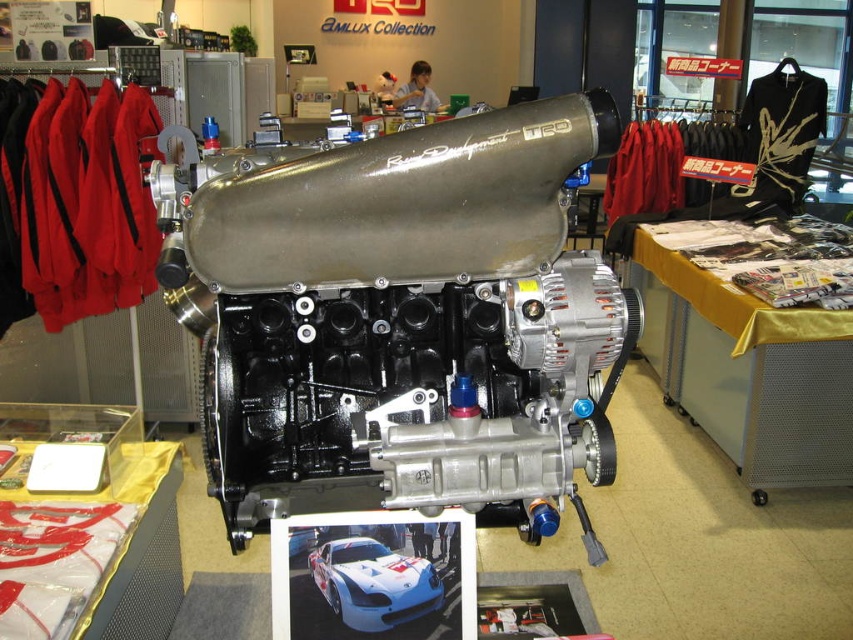
You are a technician who needs to inspect the silver metallic engine at center. If your arm can reach up to 3 feet, can you touch the engine without moving your position?

The silver metallic engine at center is 3.83 feet away from the viewer. Since your arm can only reach up to 3 feet, you cannot touch the engine without moving your position.

Based on the photo, you are an engineer inspecting the engine displayed in the showroom. You notice a specific point at coordinates (401, 317). Based on the engine layout, what component is located at that point?

The point at coordinates (401, 317) corresponds to the silver metallic engine at center.

You are a photographer who wants to capture a photo of the silver metallic engine at center and the white glossy car at center together in a single frame. The camera you are using has a maximum focus range of 15 inches. Can you fit both objects within the camera frame without moving either the camera or the objects?

The silver metallic engine at center and the white glossy car at center are 16.09 inches apart. Since the distance between them exceeds the camera maximum focus range of 15 inches, you cannot fit both objects within the camera frame without moving either the camera or the objects.